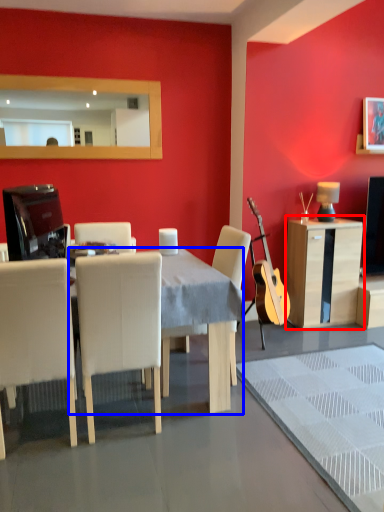
Question: Which point is closer to the camera, cabinetry (highlighted by a red box) or desk (highlighted by a blue box)?

Choices:
 (A) cabinetry
 (B) desk

Answer: (B)